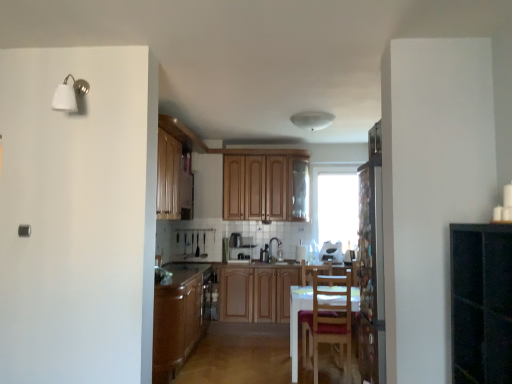
Question: Can you confirm if wooden cabinet at center, which is the second appliance from right to left, is positioned to the left of wooden chair at center?

Choices:
 (A) no
 (B) yes

Answer: (B)

Question: Does wooden cabinet at center, which is the second appliance from right to left, have a lesser width compared to wooden chair at center?

Choices:
 (A) no
 (B) yes

Answer: (B)

Question: From a real-world perspective, does wooden cabinet at center, arranged as the second appliance when viewed from the left, sit lower than wooden chair at center?

Choices:
 (A) yes
 (B) no

Answer: (B)

Question: Does wooden cabinet at center, which is the second appliance from right to left, have a greater height compared to wooden chair at center?

Choices:
 (A) yes
 (B) no

Answer: (B)

Question: Is the depth of wooden cabinet at center, arranged as the second appliance when viewed from the left, less than that of wooden chair at center?

Choices:
 (A) no
 (B) yes

Answer: (A)

Question: From the image's perspective, is satin silver toaster at center, arranged as the 3th appliance when viewed from the right, above or below wooden cabinets at center, which is counted as the first cabinetry, starting from the back?

Choices:
 (A) above
 (B) below

Answer: (B)

Question: In the image, is satin silver toaster at center, arranged as the 3th appliance when viewed from the right, positioned in front of or behind wooden cabinets at center, marked as the 2th cabinetry in a front-to-back arrangement?

Choices:
 (A) behind
 (B) front

Answer: (A)

Question: Considering the relative positions of satin silver toaster at center, arranged as the 3th appliance when viewed from the right, and wooden cabinets at center, the first cabinetry in the top-to-bottom sequence, in the image provided, is satin silver toaster at center, arranged as the 3th appliance when viewed from the right, to the left or to the right of wooden cabinets at center, the first cabinetry in the top-to-bottom sequence,?

Choices:
 (A) right
 (B) left

Answer: (B)

Question: Does point (240, 240) appear closer or farther from the camera than point (242, 210)?

Choices:
 (A) farther
 (B) closer

Answer: (B)

Question: From the image's perspective, is white glossy toaster at center, placed as the third appliance when sorted from left to right, above or below satin silver toaster at center, arranged as the 3th appliance when viewed from the right?

Choices:
 (A) above
 (B) below

Answer: (B)

Question: From a real-world perspective, is white glossy toaster at center, placed as the third appliance when sorted from left to right, above or below satin silver toaster at center, arranged as the 3th appliance when viewed from the right?

Choices:
 (A) above
 (B) below

Answer: (B)

Question: Relative to satin silver toaster at center, the first appliance when ordered from left to right, is white glossy toaster at center, placed as the third appliance when sorted from left to right, in front or behind?

Choices:
 (A) front
 (B) behind

Answer: (A)

Question: Is point (330, 248) positioned closer to the camera than point (231, 244)?

Choices:
 (A) closer
 (B) farther

Answer: (B)

Question: From a real-world perspective, is brown wood cabinet at center, the second cabinetry viewed from the right, above or below transparent glass window at center?

Choices:
 (A) above
 (B) below

Answer: (B)

Question: Is brown wood cabinet at center, the 1th cabinetry from the front, wider or thinner than transparent glass window at center?

Choices:
 (A) wide
 (B) thin

Answer: (A)